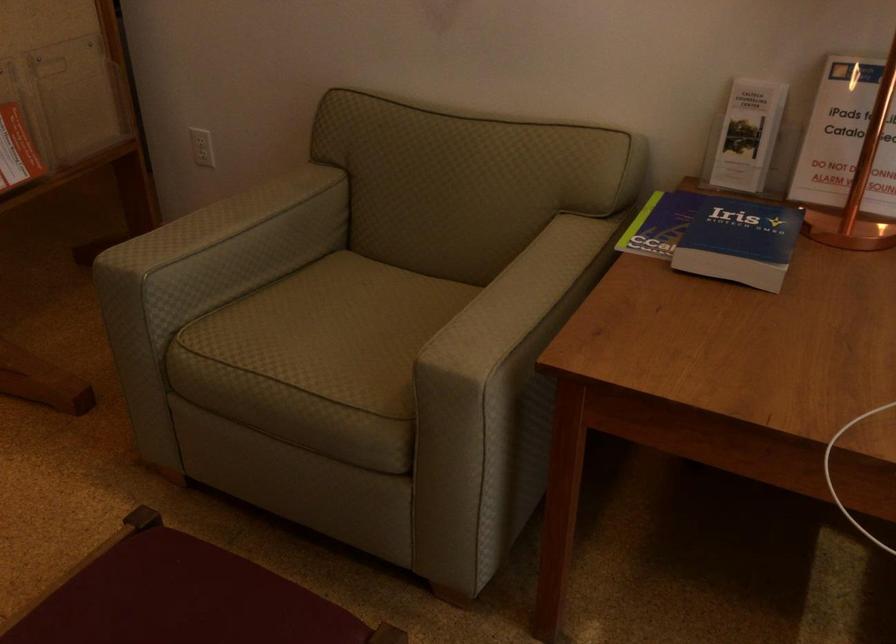
Identify the location of white wall outlet. (202, 147).